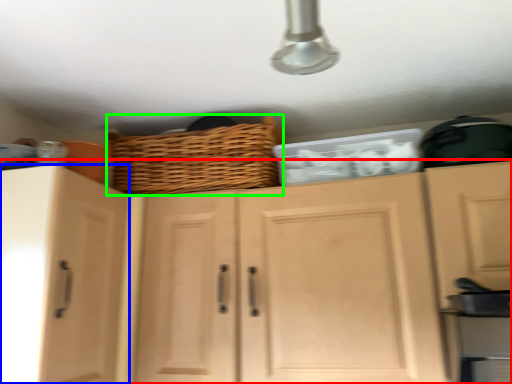
Question: Which object is the farthest from cabinetry (highlighted by a red box)? Choose among these: cabinetry (highlighted by a blue box) or basket (highlighted by a green box).

Choices:
 (A) cabinetry
 (B) basket

Answer: (B)